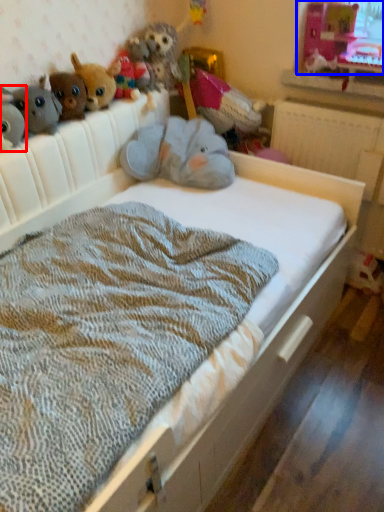
Question: Which of the following is the farthest to the observer, toy (highlighted by a red box) or window screen (highlighted by a blue box)?

Choices:
 (A) toy
 (B) window screen

Answer: (B)